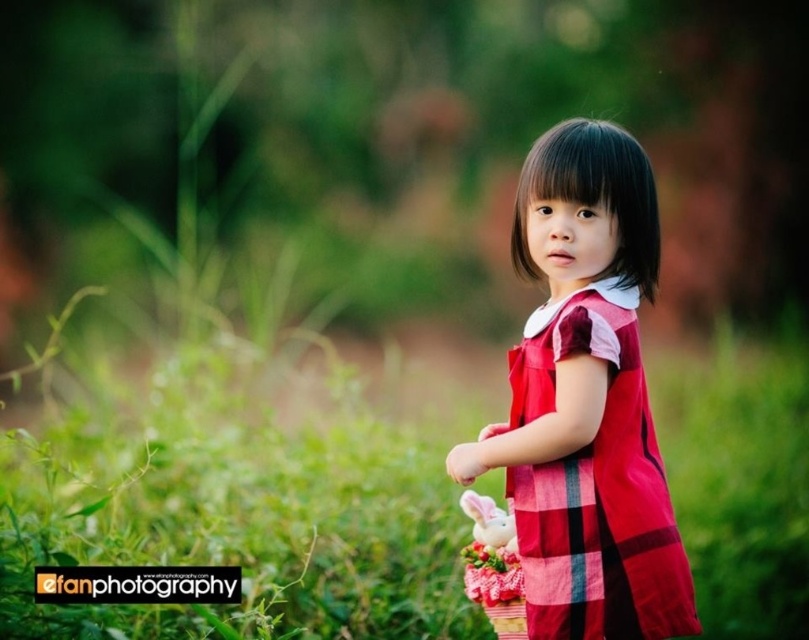
Question: Is green grass at center positioned before fluffy pink flower at center?

Choices:
 (A) yes
 (B) no

Answer: (A)

Question: Is green grass at center above red plaid dress at center?

Choices:
 (A) yes
 (B) no

Answer: (B)

Question: Which object appears farthest from the camera in this image?

Choices:
 (A) fluffy pink flower at center
 (B) red plaid dress at center

Answer: (A)

Question: Considering the real-world distances, which object is farthest from the fluffy pink flower at center?

Choices:
 (A) green grass at center
 (B) red plaid dress at center

Answer: (A)

Question: Can you confirm if red plaid dress at center is positioned to the right of fluffy pink flower at center?

Choices:
 (A) yes
 (B) no

Answer: (A)

Question: Which point is closer to the camera?

Choices:
 (A) (564, 540)
 (B) (276, 488)

Answer: (A)